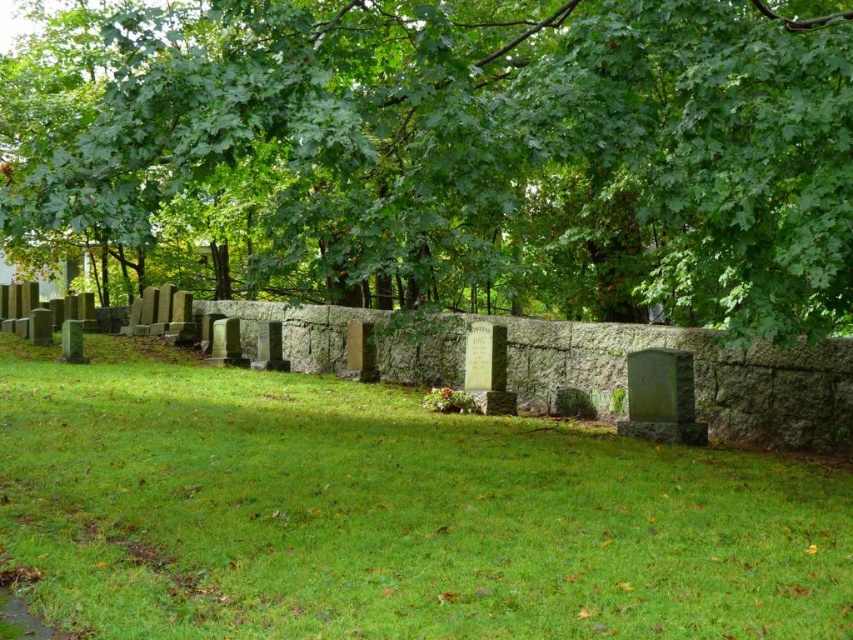
You are standing in the cemetery and want to take a photo of the green leafy tree at upper center and the green grassy at center. Which object should you frame first in your camera viewfinder to ensure both are in the shot?

The green leafy tree at upper center should be framed first because it is positioned to the left of the green grassy at center, so starting with the tree ensures both are captured in the frame.

You are standing in the cemetery looking at the green leafy tree at upper center and the green grassy at center. Which object is higher in the image?

The green leafy tree at upper center is located above the green grassy at center, so it is higher in the image.